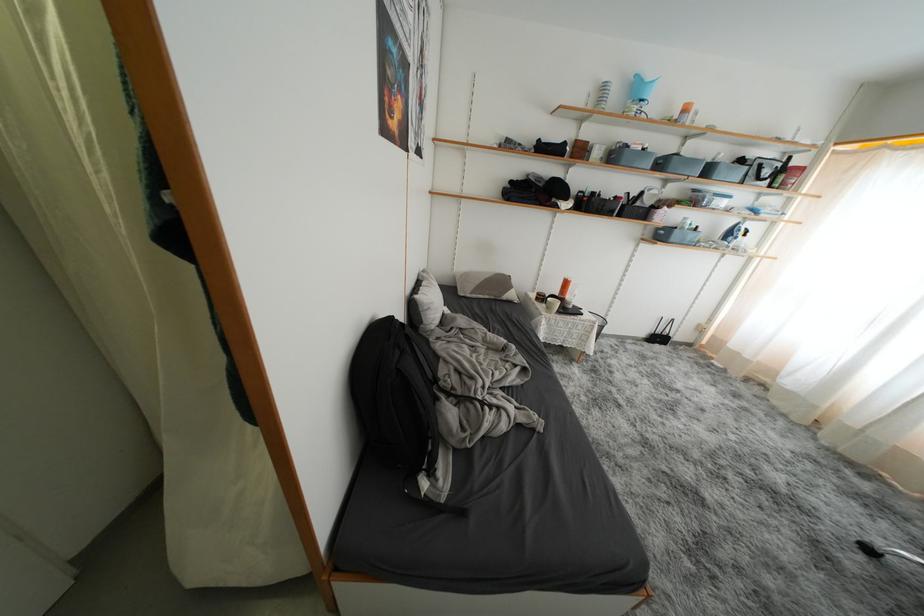
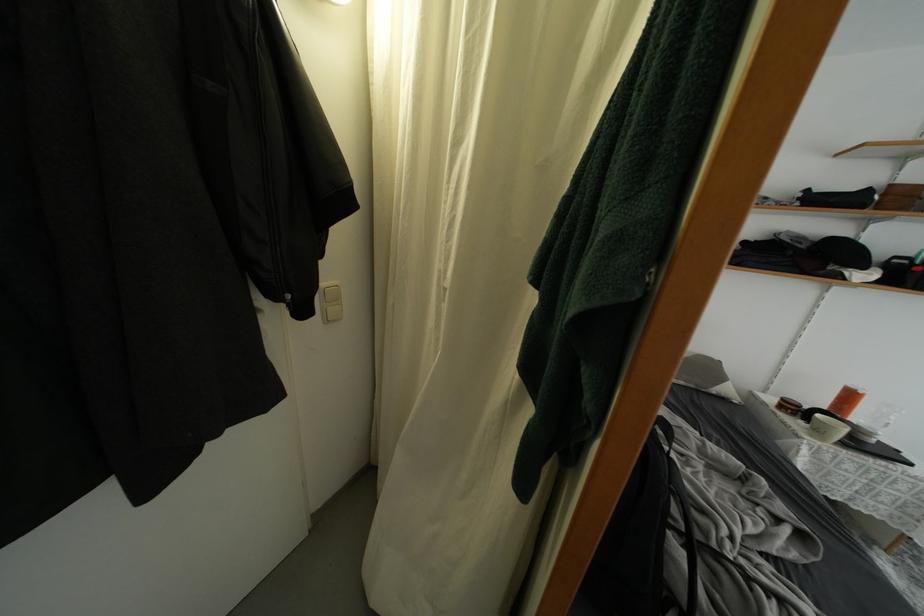
Find the pixel in the second image that matches (x=572, y=286) in the first image.

(856, 400)